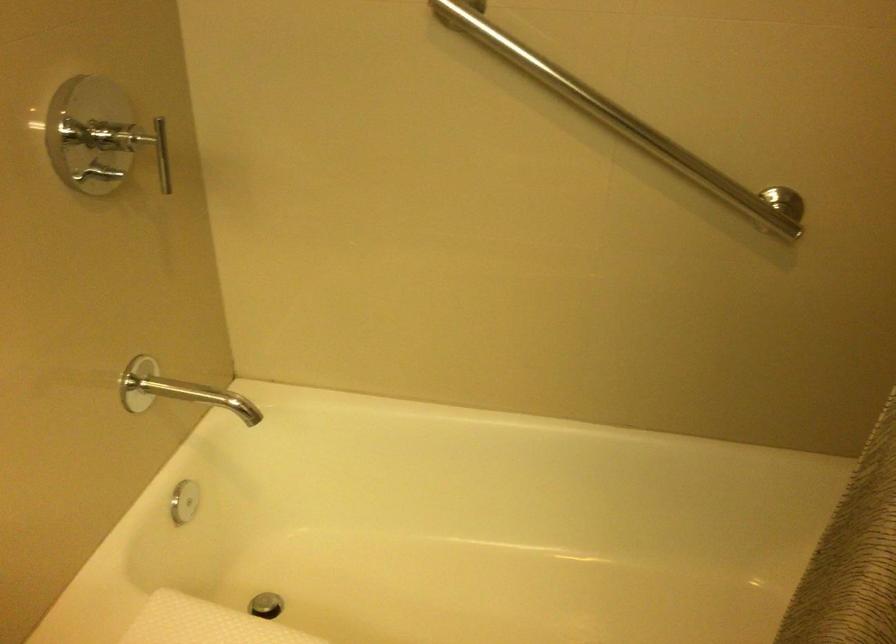
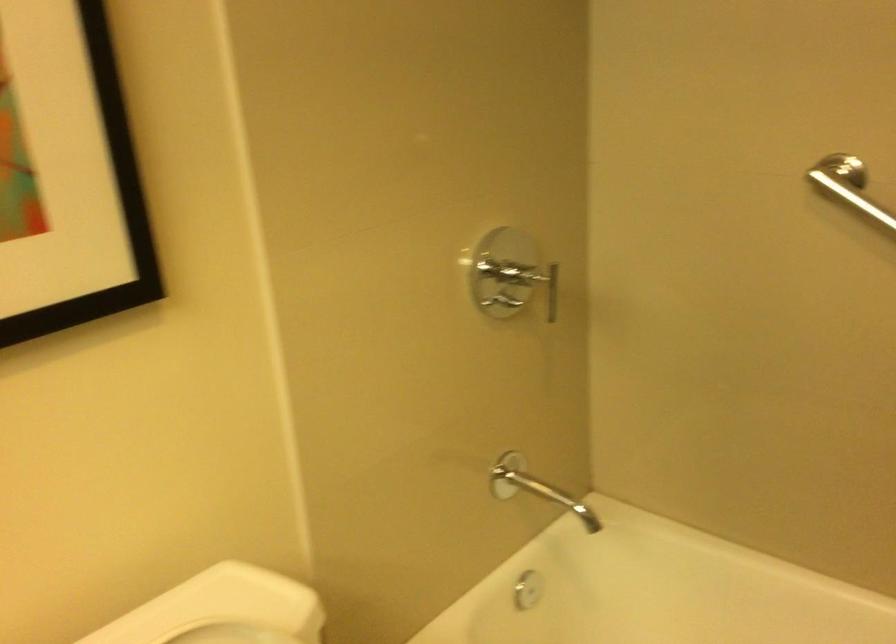
Question: The images are taken continuously from a first-person perspective. In which direction is your viewpoint rotating?

Choices:
 (A) Left
 (B) Right
 (C) Up
 (D) Down

Answer: (A)